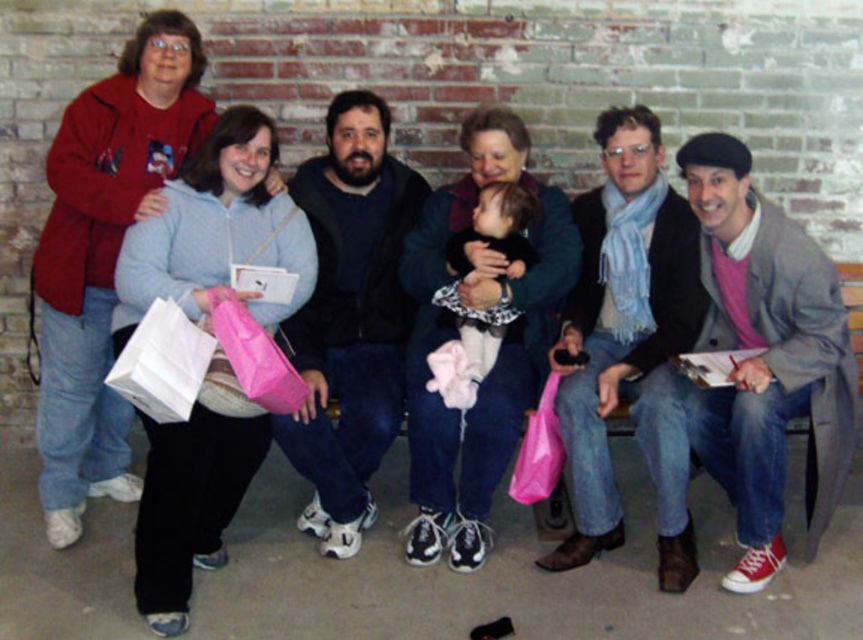
You are a photographer trying to capture a candid shot of the group on the bench. You notice the blue scarf at center and the fluffy pink blanket at center. To ensure the scarf is visible in the photo, where should you position it relative to the blanket?

The blue scarf at center is located below the fluffy pink blanket at center. To ensure visibility, position the scarf so it is not covered by the blanket.

You are organizing a picnic and need to decide which item to use for seating. The dark blue fleece at center and the fluffy pink blanket at center are both available. Which one would provide more coverage area for seating?

The fluffy pink blanket at center has a greater width than the dark blue fleece at center, so it would provide more coverage area for seating.

You are a photographer trying to capture a candid shot of the group on the bench. You notice the pink wool sweater at right and the fluffy pink blanket at center. To ensure both are visible in the frame, which object should you position closer to the camera?

The pink wool sweater at right should be positioned closer to the camera since it is in front of the fluffy pink blanket at center, making it naturally closer to the viewer.